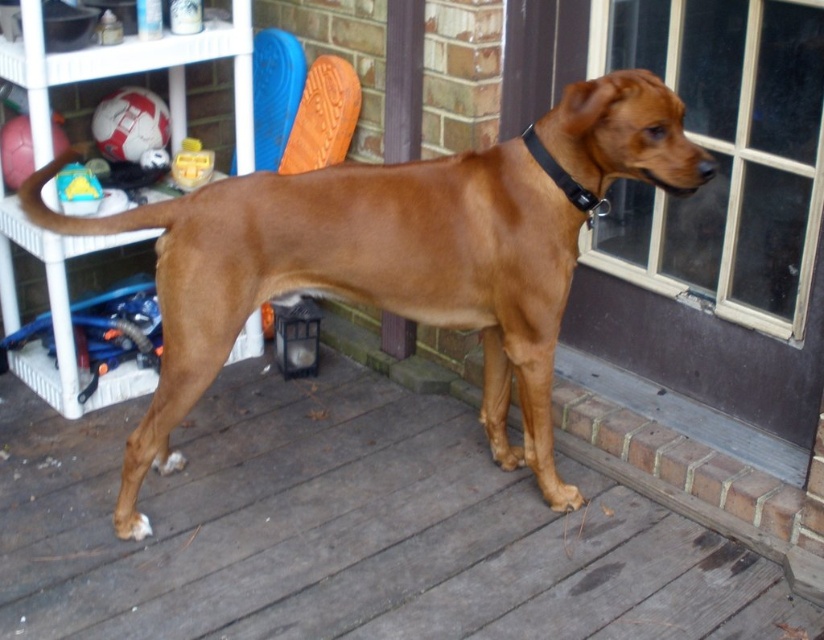
Question: Can you confirm if brown wooden deck at center is bigger than transparent glass door at upper right?

Choices:
 (A) yes
 (B) no

Answer: (A)

Question: Does brown wooden deck at center appear on the right side of brown shiny dog at center?

Choices:
 (A) no
 (B) yes

Answer: (A)

Question: Which object is positioned farthest from the brown shiny dog at center?

Choices:
 (A) black leather collar at upper center
 (B) transparent glass door at upper right

Answer: (B)

Question: Which object is positioned farthest from the brown shiny dog at center?

Choices:
 (A) transparent glass door at upper right
 (B) black leather collar at upper center
 (C) brown wooden deck at center

Answer: (A)

Question: Can you confirm if transparent glass door at upper right is positioned below black leather collar at upper center?

Choices:
 (A) yes
 (B) no

Answer: (B)

Question: Estimate the real-world distances between objects in this image. Which object is farther from the brown wooden deck at center?

Choices:
 (A) brown shiny dog at center
 (B) transparent glass door at upper right
 (C) black leather collar at upper center

Answer: (C)